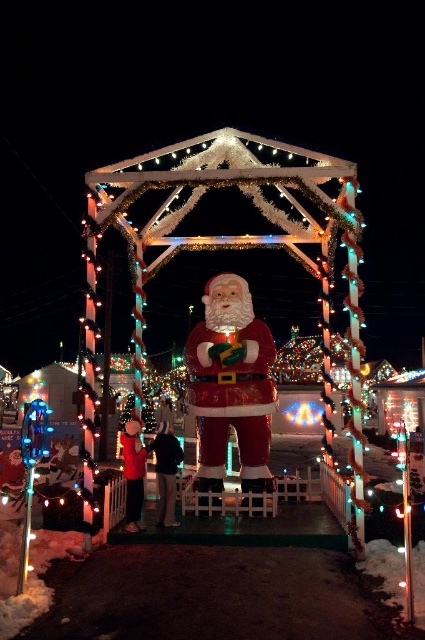
Which is below, shiny plastic santa at center or red glossy santa claus at center?

red glossy santa claus at center is lower down.

Which of these two, shiny plastic santa at center or red glossy santa claus at center, stands shorter?

red glossy santa claus at center

Between point (101, 186) and point (263, 362), which one is positioned in front?

Point (101, 186)

Image resolution: width=425 pixels, height=640 pixels. Find the location of `shiny plastic santa at center`. shiny plastic santa at center is located at coordinates (234, 246).